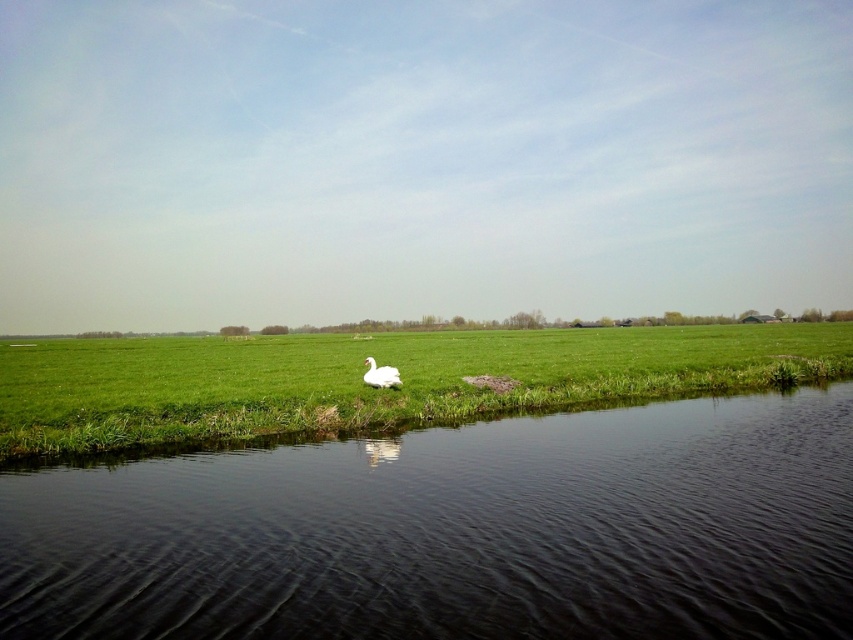
You are standing at the edge of the black water at lower center and want to retrieve a small floating object that is 5 meters away from you. Can you reach it without wading into the water beyond 7 meters?

The black water at lower center is 7.18 meters away from the viewer. Since the object is only 5 meters away from you, you can reach it without exceeding the 7 meters limit.

You are a drone operator flying a drone over a rural landscape. Your drone is currently at coordinates 0.833, 0.536. There is a black water at lower center. What is the object directly below your drone?

The black water at lower center is located at point (456, 532), so the object directly below your drone is the black water at lower center.